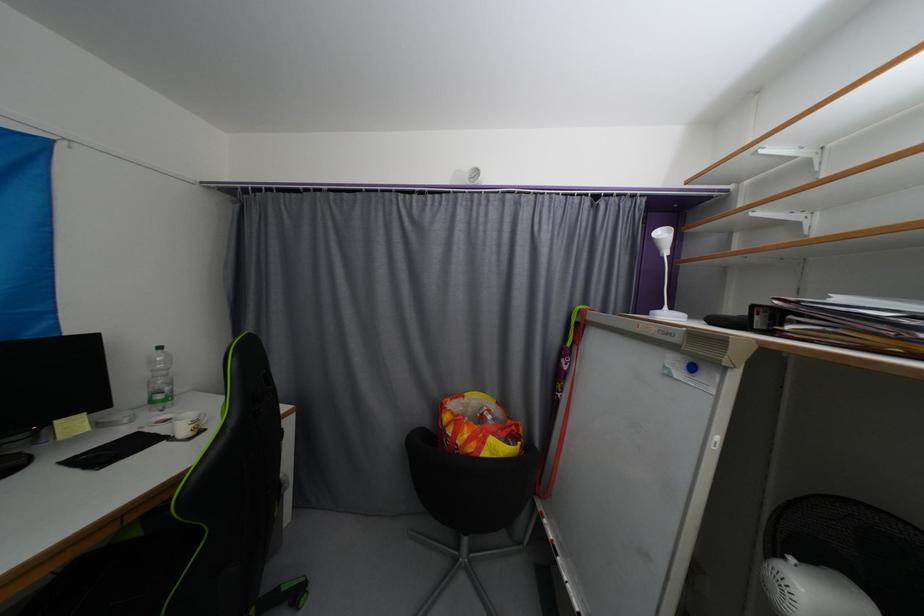
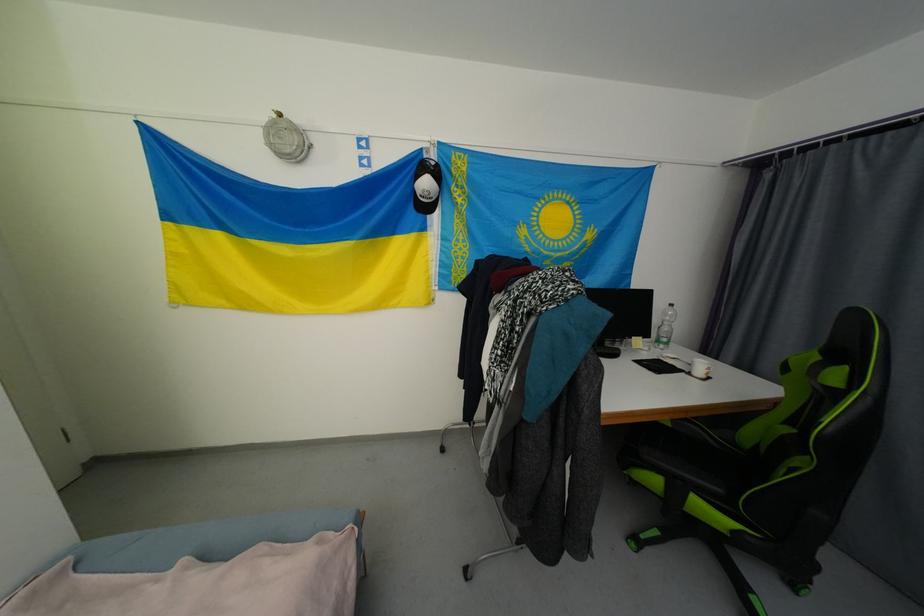
Question: Based on the continuous images, in which direction is the camera rotating? Reply with the corresponding letter.

Choices:
 (A) Left
 (B) Right
 (C) Up
 (D) Down

Answer: (A)